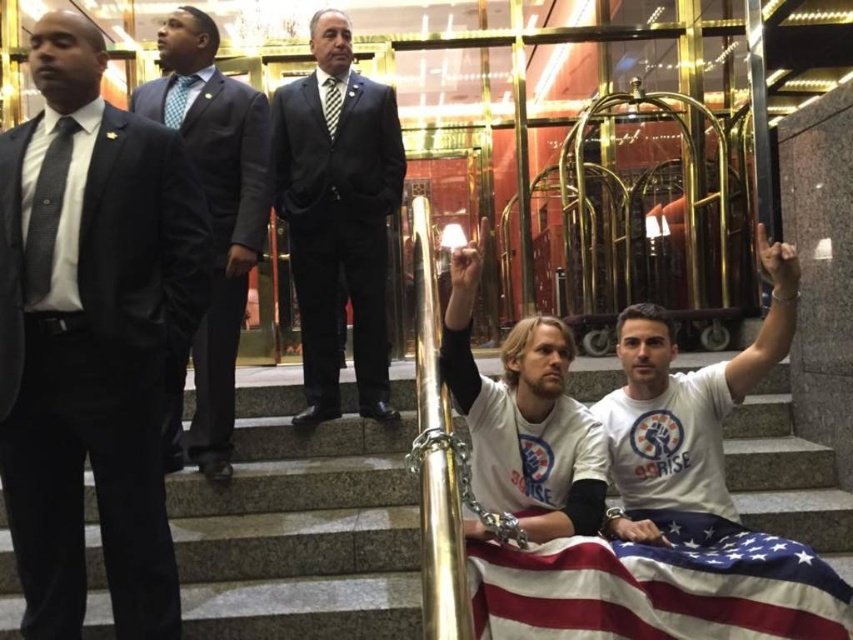
Is matte black suit at left thinner than black suit at center?

Yes.

Can you confirm if matte black suit at left is bigger than black suit at center?

Incorrect, matte black suit at left is not larger than black suit at center.

Does point (39, 410) come farther from viewer compared to point (355, 260)?

That is False.

Image resolution: width=853 pixels, height=640 pixels. In order to click on matte black suit at left in this screenshot , I will do `click(91, 337)`.

Which is in front, point (154, 115) or point (715, 508)?

Positioned in front is point (715, 508).

Image resolution: width=853 pixels, height=640 pixels. Describe the element at coordinates (213, 208) in the screenshot. I see `shiny black suit at upper left` at that location.

What are the coordinates of `shiny black suit at upper left` in the screenshot? It's located at (213, 208).

In the scene shown: Who is more forward, (264, 150) or (502, 440)?

Point (502, 440) is more forward.

Which is in front, point (196, 444) or point (572, 525)?

Point (572, 525) is more forward.

Identify the location of shiny black suit at upper left. The height and width of the screenshot is (640, 853). (213, 208).